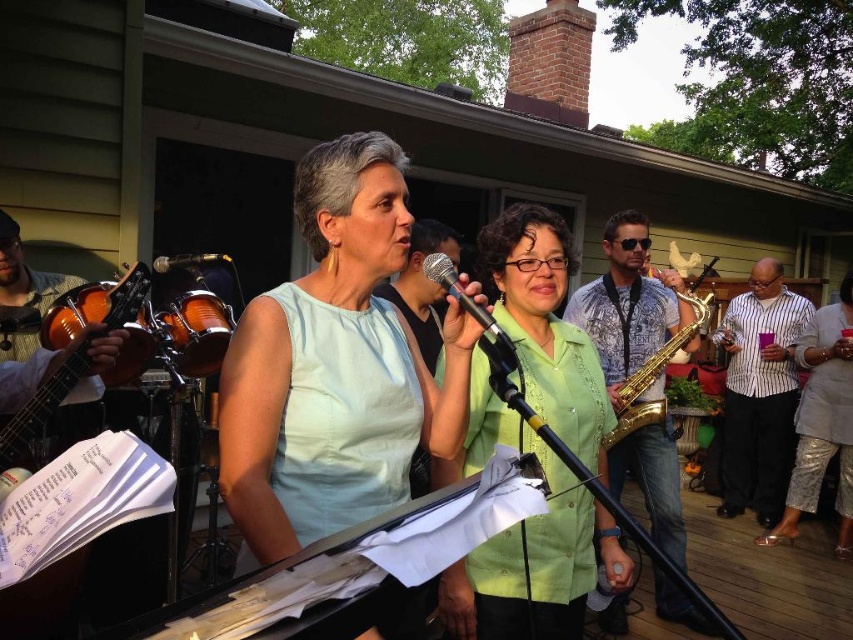
Question: Which of these objects is positioned farthest from the white striped shirt at center?

Choices:
 (A) wooden drum at left
 (B) gold metallic saxophone at center-right
 (C) green matte shirt at center
 (D) light blue fabric shirt at center

Answer: (D)

Question: Which object appears farthest from the camera in this image?

Choices:
 (A) light blue fabric shirt at center
 (B) shiny gold saxophone at center
 (C) striped cotton shirt at center
 (D) wooden acoustic guitar at left

Answer: (C)

Question: Which point is closer to the camera taking this photo?

Choices:
 (A) (556, 564)
 (B) (737, 417)
 (C) (161, 257)

Answer: (A)

Question: Is striped cotton shirt at center further to camera compared to wooden acoustic guitar at left?

Choices:
 (A) yes
 (B) no

Answer: (A)

Question: Is white striped shirt at center below wooden drum at left?

Choices:
 (A) no
 (B) yes

Answer: (B)

Question: Is light blue fabric shirt at center above wooden drum at left?

Choices:
 (A) yes
 (B) no

Answer: (B)